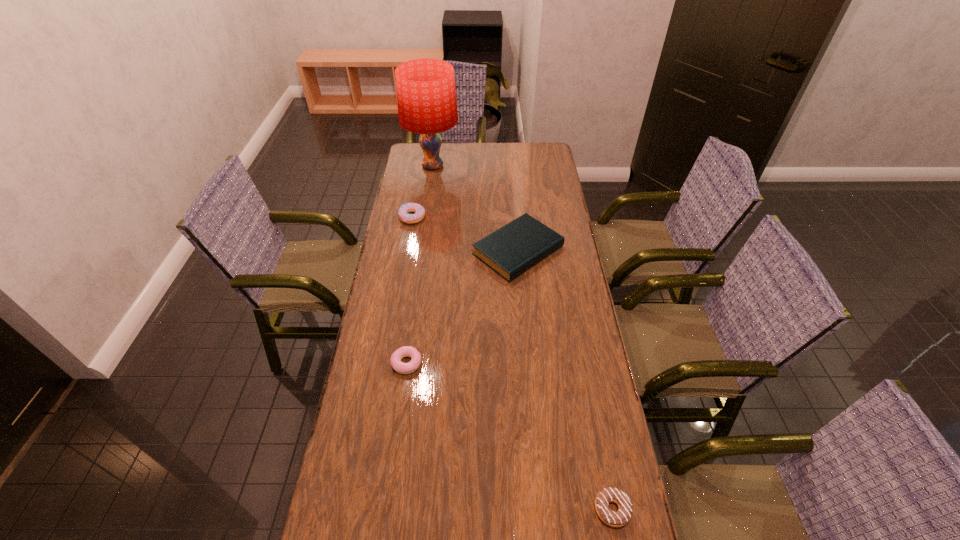
The height and width of the screenshot is (540, 960). I want to click on free point at the far right corner, so click(538, 167).

Identify the location of vacant area that lies between the rightmost doughnut and the second nearest doughnut. The width and height of the screenshot is (960, 540). (510, 436).

Identify the location of vacant area that lies between the second nearest doughnut and the farthest object. (420, 265).

Locate an element on the screen. empty space that is in between the second farthest doughnut and the nearest object is located at coordinates (510, 436).

At what (x,y) coordinates should I click in order to perform the action: click on vacant area that lies between the second nearest object and the book. Please return your answer as a coordinate pair (x, y). This screenshot has width=960, height=540. Looking at the image, I should click on coord(463,307).

Where is `free space between the second nearest object and the book`? The image size is (960, 540). free space between the second nearest object and the book is located at coordinates (x=463, y=307).

I want to click on object that is the second closest one to the rightmost doughnut, so click(511, 250).

Identify which object is the fourth nearest to the farthest doughnut. Please provide its 2D coordinates. Your answer should be formatted as a tuple, i.e. [(x, y)], where the tuple contains the x and y coordinates of a point satisfying the conditions above.

[(620, 518)]

Image resolution: width=960 pixels, height=540 pixels. I want to click on doughnut identified as the third closest to the book, so (x=620, y=518).

Select which doughnut appears as the second closest to the book. Please provide its 2D coordinates. Your answer should be formatted as a tuple, i.e. [(x, y)], where the tuple contains the x and y coordinates of a point satisfying the conditions above.

[(406, 351)]